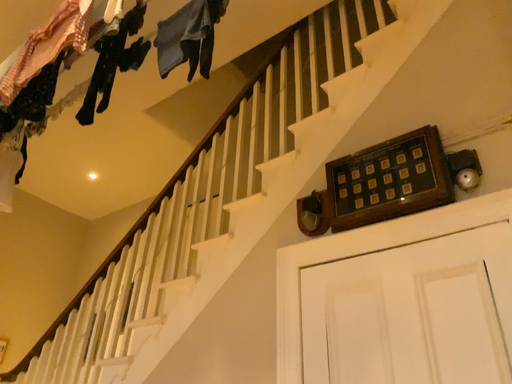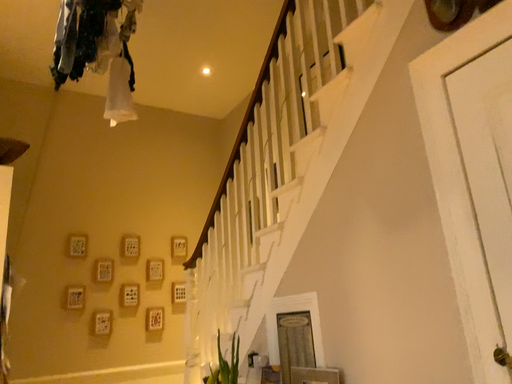
Question: How did the camera likely rotate when shooting the video?

Choices:
 (A) rotated right
 (B) rotated left

Answer: (B)